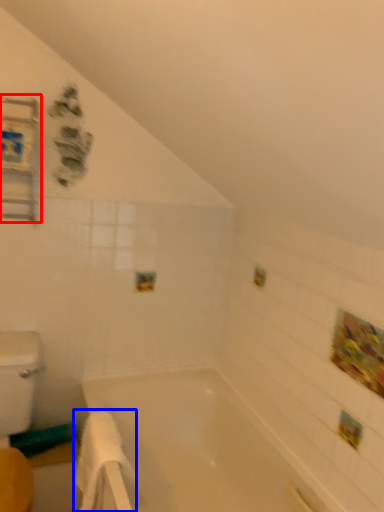
Question: Among these objects, which one is nearest to the camera, medicine cabinet (highlighted by a red box) or bath towel (highlighted by a blue box)?

Choices:
 (A) medicine cabinet
 (B) bath towel

Answer: (B)